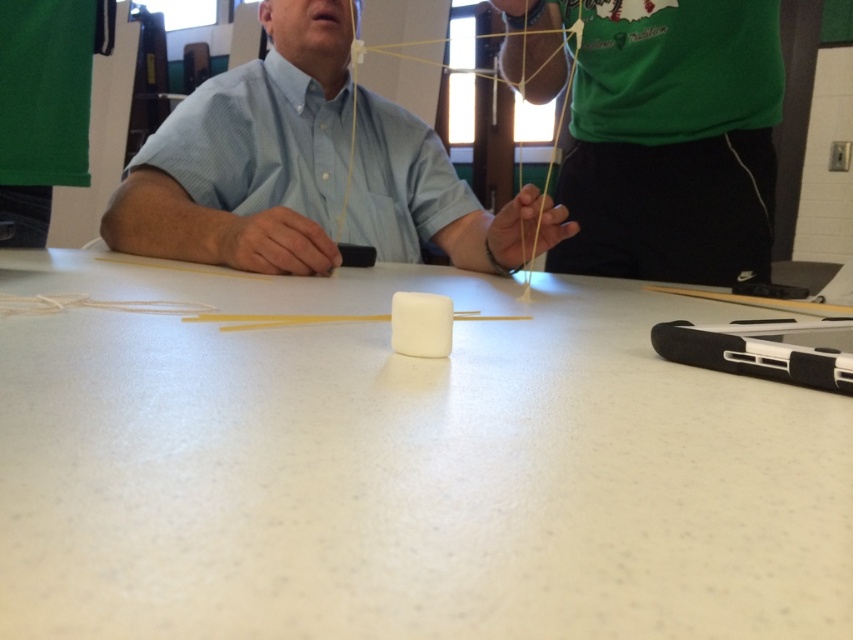
You are trying to build a structure with the marshmallow and skewers on the white matte table at center. If you want to move closer to the green matte shirt at upper center, which direction should you move relative to the table?

Since the white matte table at center is in front of the green matte shirt at upper center, you should move backward away from the table to get closer to the green matte shirt at upper center.

You are trying to place a small toy on the table without it falling off. Given that the white matte table at center is below matte blue shirt at center, where should you position the toy to ensure it stays on the table?

Place the toy on the white matte table at center, as it is the surface below the matte blue shirt at center and is stable for placing items.

You are standing at the point labeled as point (224,180) and want to reach the point labeled as point (399,488). Which direction should you move to get there?

You should move forward because point (399,488) is in front of point (224,180).